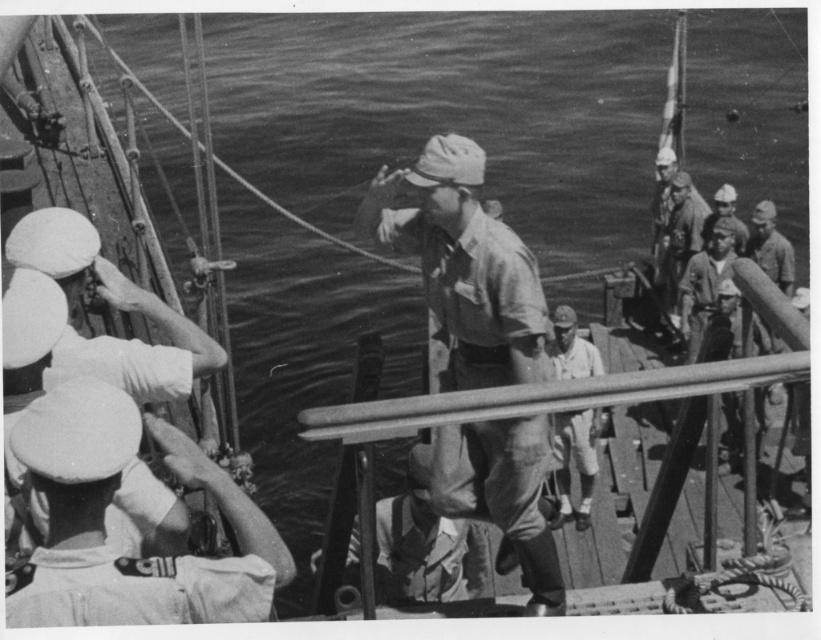
Question: Is white matte uniform at left to the left of light beige uniform at center from the viewer's perspective?

Choices:
 (A) yes
 (B) no

Answer: (A)

Question: Which point appears closest to the camera in this image?

Choices:
 (A) [x=576, y=348]
 (B) [x=739, y=246]
 (C) [x=434, y=456]
 (D) [x=83, y=566]

Answer: (D)

Question: Among these objects, which one is farthest from the camera?

Choices:
 (A) light beige uniform at center
 (B) white matte uniform at left

Answer: (A)

Question: Estimate the real-world distances between objects in this image. Which object is closer to the light beige uniform at center?

Choices:
 (A) smooth skin face at upper right
 (B) white matte uniform at left
 (C) matte khaki uniform at center

Answer: (A)

Question: Can you confirm if matte khaki uniform at center is wider than smooth skin face at upper right?

Choices:
 (A) no
 (B) yes

Answer: (A)

Question: Is matte khaki uniform at center further to the viewer compared to white matte uniform at left?

Choices:
 (A) yes
 (B) no

Answer: (A)